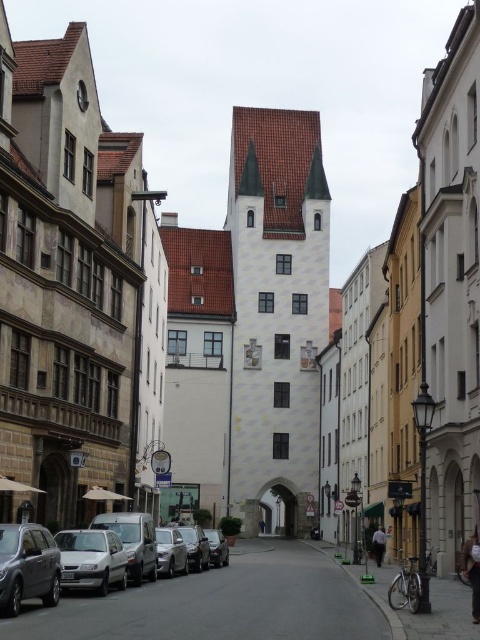
Question: Which is nearer to the metallic gray suv at lower left?

Choices:
 (A) smooth asphalt road at center
 (B) shiny silver sedan at center

Answer: (A)

Question: Considering the relative positions of silver metallic car at lower left and silver metallic sedan at lower left in the image provided, where is silver metallic car at lower left located with respect to silver metallic sedan at lower left?

Choices:
 (A) left
 (B) right

Answer: (B)

Question: Which object is farther from the camera taking this photo?

Choices:
 (A) shiny silver sedan at center
 (B) smooth asphalt road at center
 (C) metallic gray suv at lower left
 (D) silver metallic car at center

Answer: (A)

Question: Does silver metallic sedan at lower left appear on the left side of satin silver car at center?

Choices:
 (A) no
 (B) yes

Answer: (B)

Question: Which of the following is the farthest from the observer?

Choices:
 (A) silver metallic car at center
 (B) silver metallic car at lower left
 (C) metallic gray suv at lower left

Answer: (A)

Question: Where is silver metallic sedan at lower left located in relation to silver metallic car at center in the image?

Choices:
 (A) left
 (B) right

Answer: (A)